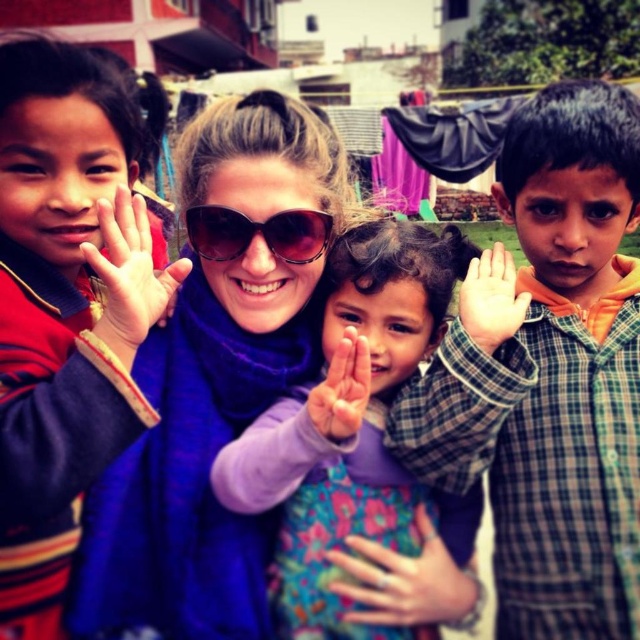
What are the coordinates of the checkered fabric shirt at right?

The checkered fabric shirt at right is located at coordinates point (548, 374).

You are a photographer trying to capture the purple scarf at center in your shot. Based on its 2D coordinates, where should you position your camera to ensure the scarf is centered in the frame?

To center the purple scarf at center in the frame, position your camera so that the center of the viewfinder aligns with the coordinates point [196,458].